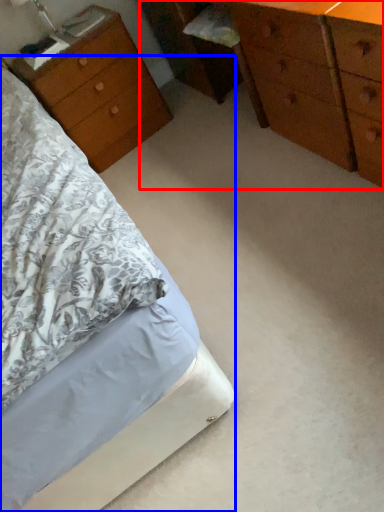
Question: Among these objects, which one is farthest to the camera, chest of drawers (highlighted by a red box) or bed (highlighted by a blue box)?

Choices:
 (A) chest of drawers
 (B) bed

Answer: (A)